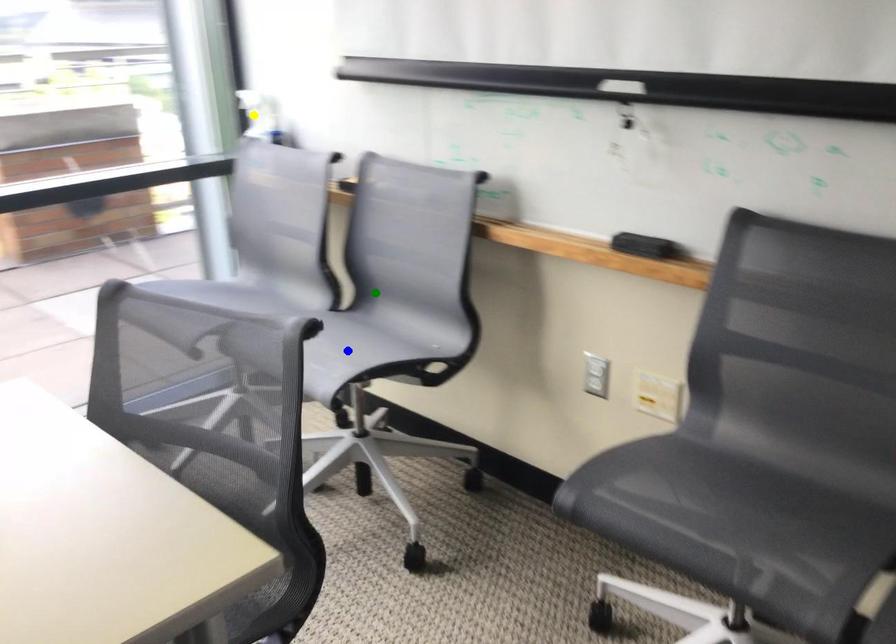
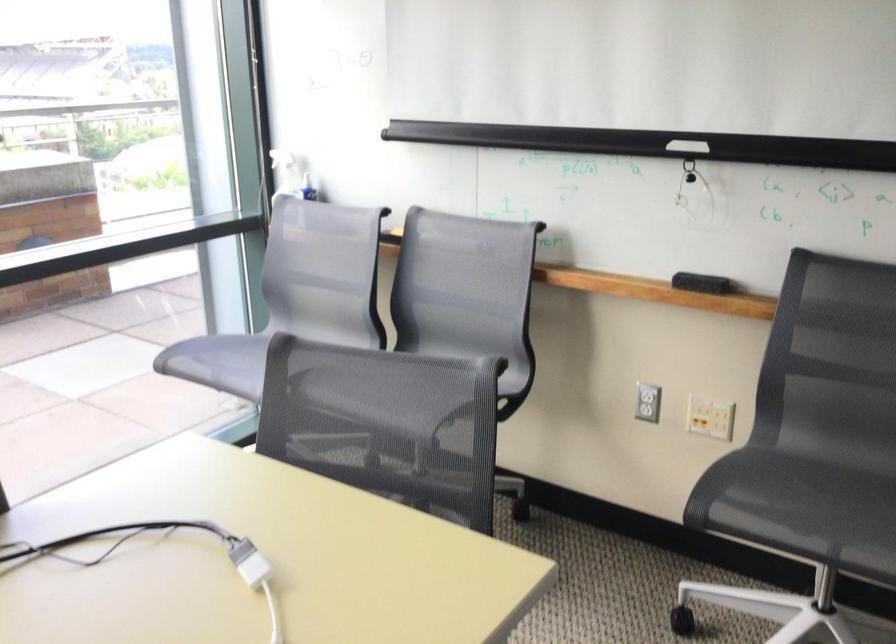
I am providing you with two images of the same scene from different viewpoints. Three points are marked in image1. Which point corresponds to a part or object that is occluded in image2?In image1, three points are marked. Which of them correspond to a part or object that is occluded in image2?Among the three points shown in image1, which one corresponds to a part or object that is no longer visible due to occlusion in image2?

Invisible in image2: blue point.